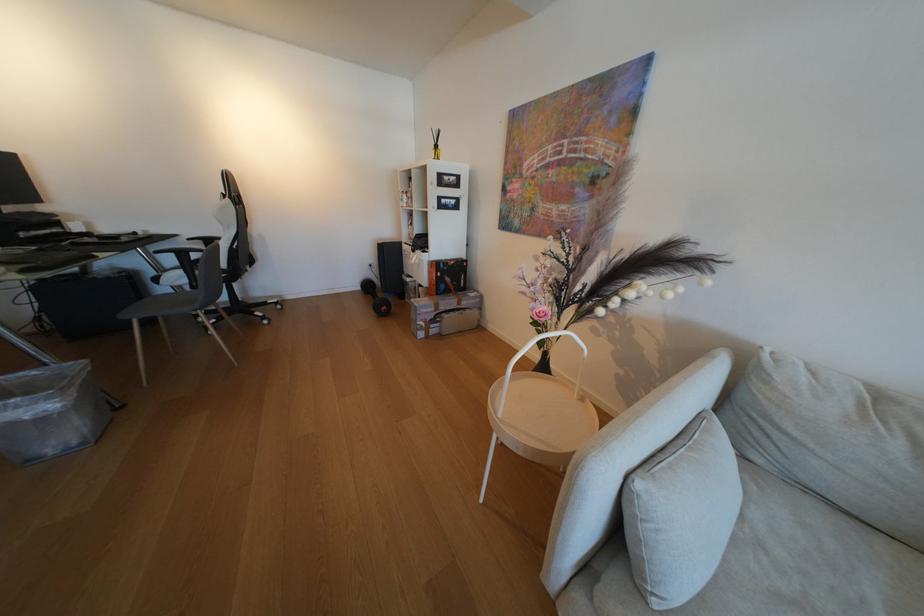
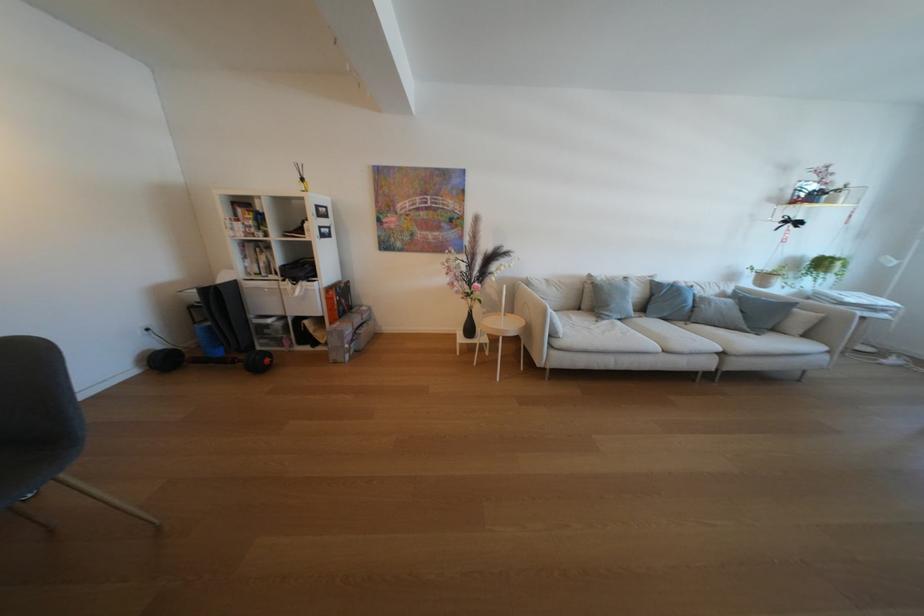
Locate, in the second image, the point that corresponds to pixel 417 204 in the first image.

(256, 233)